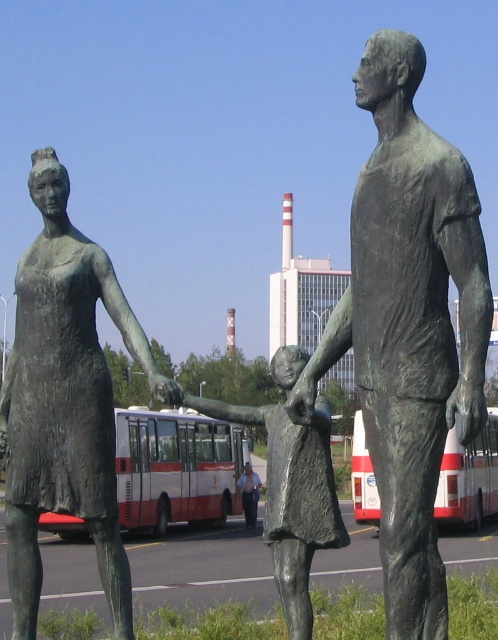
You are a city planner reviewing a public space design. You see the bronze statue at left and the light blue shirt at center in the image. Based on their sizes, which object would require more space for proper placement in a public area?

The bronze statue at left is bigger than the light blue shirt at center, so it would require more space for proper placement in a public area.

You are a pedestrian standing at the bronze statue at left. You want to cross the road to reach the red and white bus. The road is 10.51 meters wide. Can you safely cross the road in one go without stopping?

The distance between the bronze statue at left and the red and white bus is 10.51 meters. Since the road is 10.51 meters wide, you can safely cross it in one go without stopping if you walk at a reasonable pace before the traffic light changes.